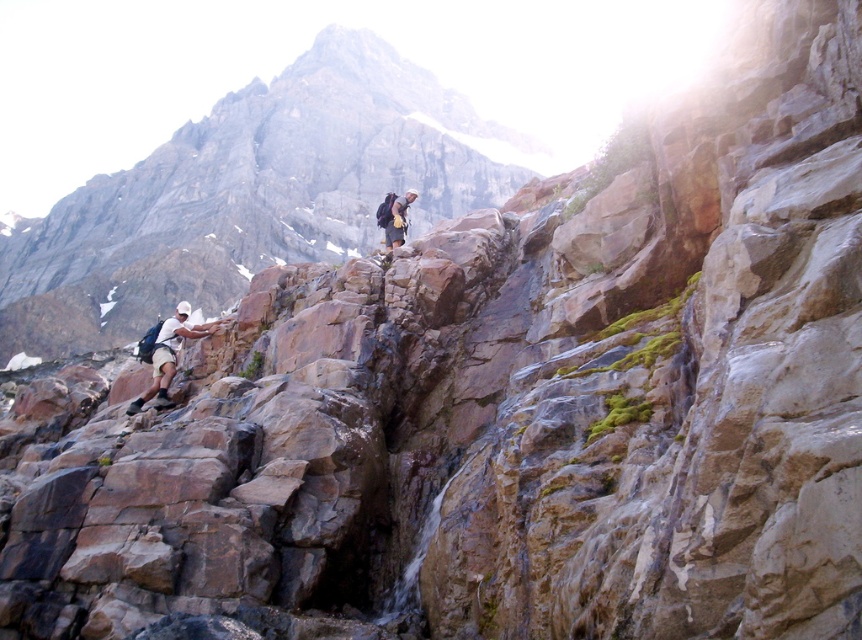
You are a climber trying to reach the summit. You have a matte black backpack at center and see a brown rock at left. Which object is positioned more to the left?

The brown rock at left is positioned to the left of the matte black backpack at center, so it is more to the left.